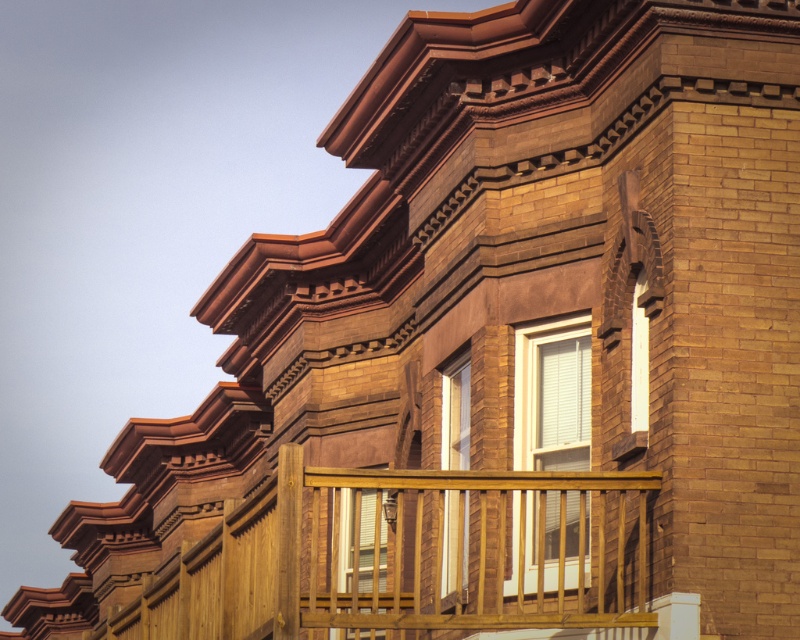
Question: Can you confirm if white matte window at upper right is positioned below matte white window at center?

Choices:
 (A) no
 (B) yes

Answer: (A)

Question: Does white matte window at upper right have a lesser width compared to matte white window at center?

Choices:
 (A) yes
 (B) no

Answer: (A)

Question: Which object appears farthest from the camera in this image?

Choices:
 (A) wooden at upper center
 (B) white matte window at upper right
 (C) matte glass window at center

Answer: (B)

Question: Does white matte window at upper right have a larger size compared to matte glass window at center?

Choices:
 (A) yes
 (B) no

Answer: (B)

Question: Which object is positioned closest to the wooden at upper center?

Choices:
 (A) matte glass window at center
 (B) matte white window at center

Answer: (B)

Question: Which of the following is the closest to the observer?

Choices:
 (A) (350, 596)
 (B) (554, 468)
 (C) (466, 417)

Answer: (A)